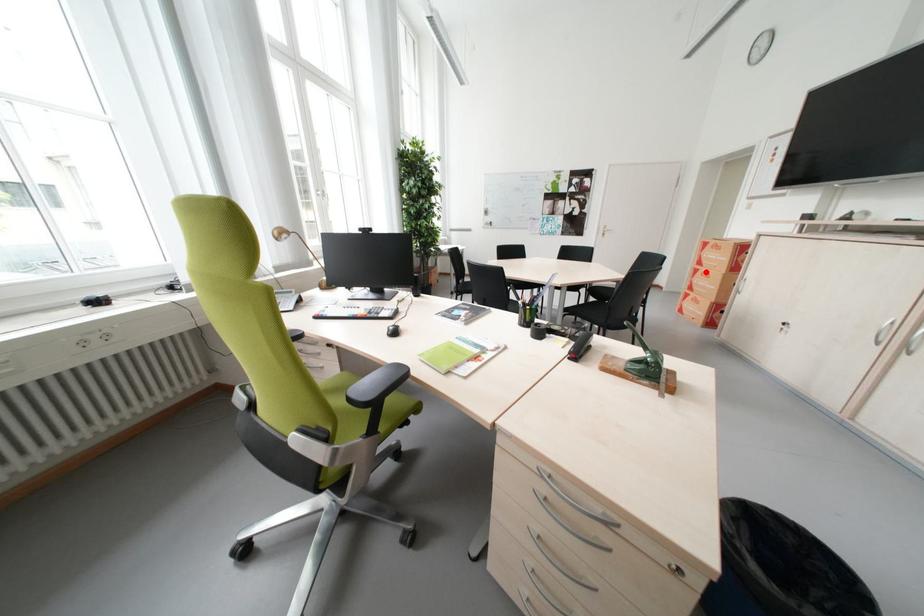
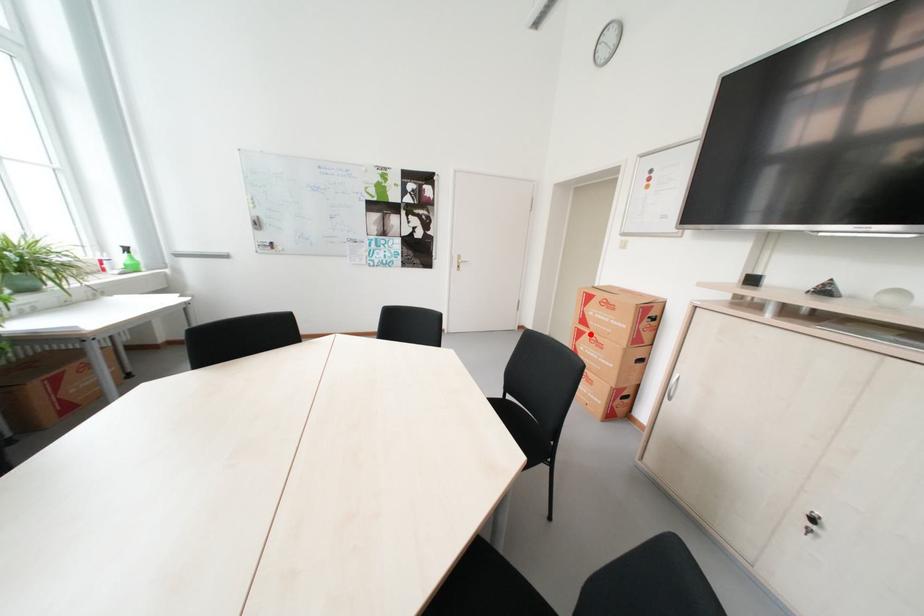
I am providing you with two images of the same scene from different viewpoints. A red point is marked on the first image and another point is marked on the second image. Are the points marked in image1 and image2 representing the same 3D position?

Yes